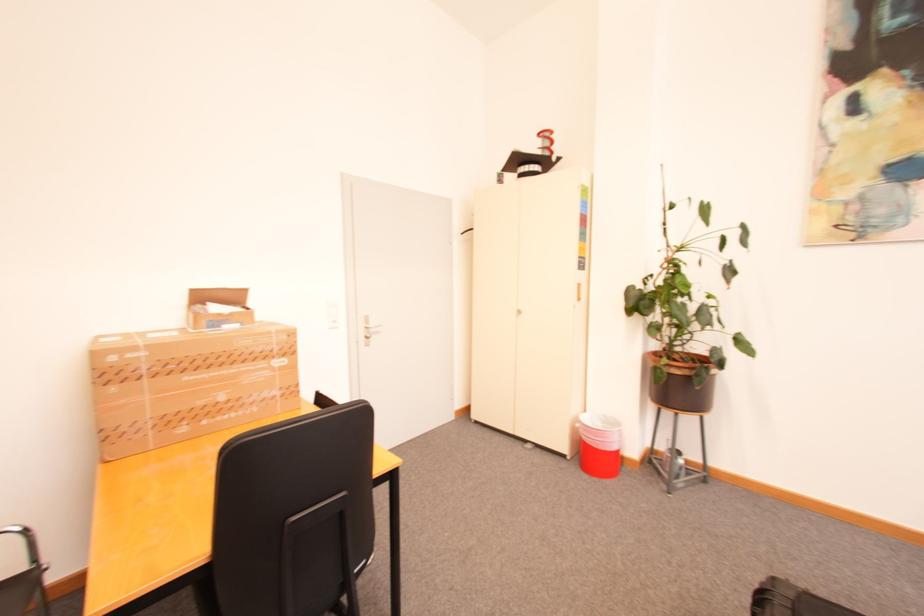
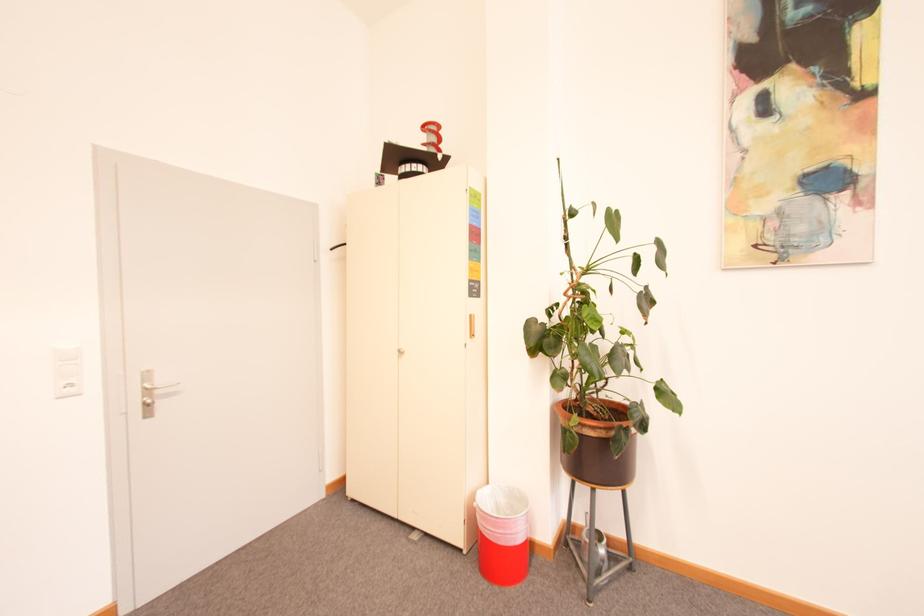
Question: How did the camera likely rotate?

Choices:
 (A) Left
 (B) Right
 (C) Up
 (D) Down

Answer: (B)